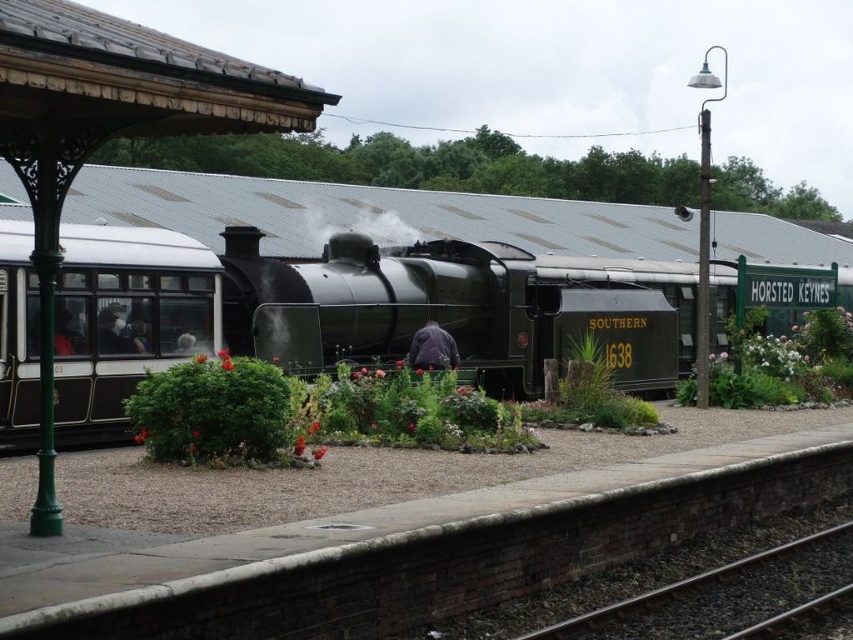
Question: Can you confirm if polished black steam locomotive at center is positioned to the right of shiny black steam locomotive at center?

Choices:
 (A) no
 (B) yes

Answer: (B)

Question: Is matte black passenger car at left above black gravel train track at lower right?

Choices:
 (A) yes
 (B) no

Answer: (A)

Question: Which of the following is the closest to the observer?

Choices:
 (A) (80, 368)
 (B) (305, 227)

Answer: (A)

Question: Which of the following is the closest to the observer?

Choices:
 (A) polished black steam locomotive at center
 (B) matte black passenger car at left
 (C) black gravel train track at lower right
 (D) shiny black steam locomotive at center

Answer: (C)

Question: Among these objects, which one is nearest to the camera?

Choices:
 (A) matte black passenger car at left
 (B) black gravel train track at lower right
 (C) polished black steam locomotive at center

Answer: (B)

Question: In this image, where is polished black steam locomotive at center located relative to shiny black steam locomotive at center?

Choices:
 (A) below
 (B) above

Answer: (A)